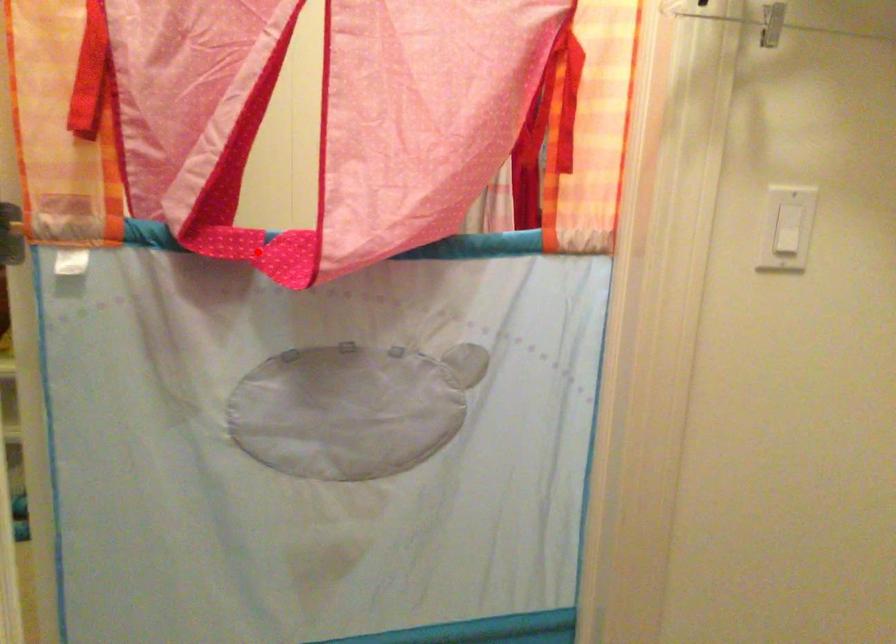
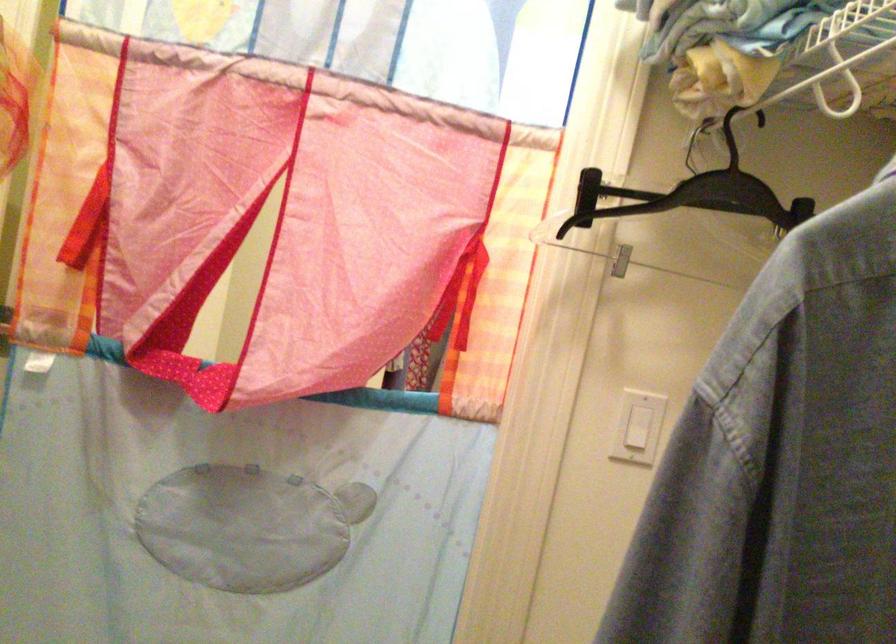
Question: A red point is marked in image1. In image2, is the corresponding 3D point closer to the camera or farther? Reply with the corresponding letter.

Choices:
 (A) The corresponding 3D point is closer.
 (B) The corresponding 3D point is farther.

Answer: (B)